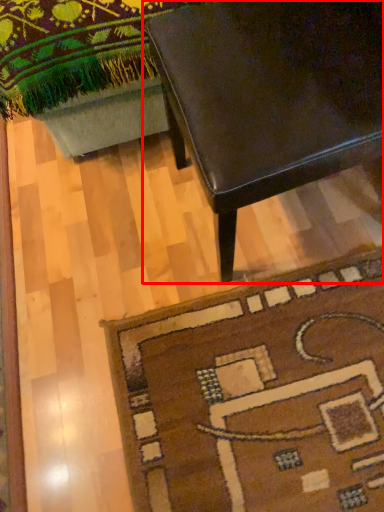
Question: Observing the image, what is the correct spatial positioning of table (annotated by the red box) in reference to mat?

Choices:
 (A) left
 (B) right

Answer: (B)